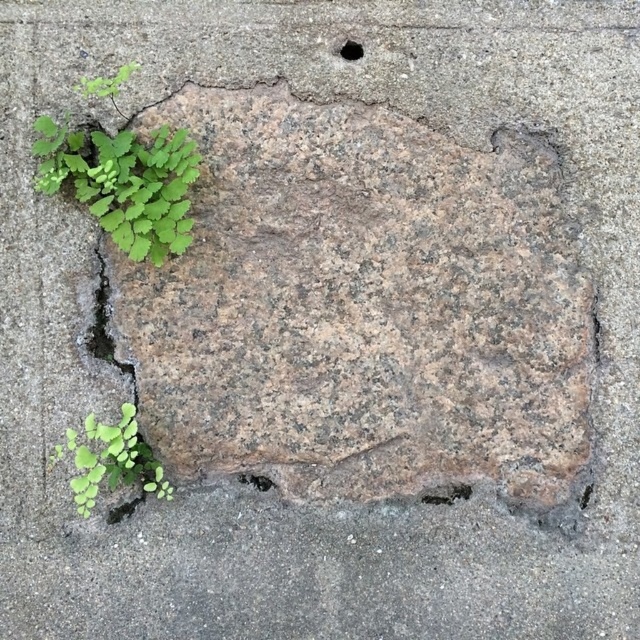
Question: Can you confirm if green leafy plant at upper left is positioned to the left of rusty metal patch at lower left?

Choices:
 (A) no
 (B) yes

Answer: (B)

Question: Estimate the real-world distances between objects in this image. Which object is closer to the brown rough stone at center?

Choices:
 (A) green leafy plant at upper left
 (B) rusty metal patch at lower left

Answer: (A)

Question: Is green leafy plant at upper left thinner than black smooth hole at upper center?

Choices:
 (A) no
 (B) yes

Answer: (A)

Question: Which point is closer to the camera?

Choices:
 (A) black smooth hole at upper center
 (B) green leafy plant at lower left

Answer: (B)

Question: Which of the following is the closest to the observer?

Choices:
 (A) (109, 429)
 (B) (72, 164)
 (C) (362, 48)

Answer: (A)

Question: Can you confirm if green leafy plant at upper left is wider than black smooth hole at upper center?

Choices:
 (A) yes
 (B) no

Answer: (A)